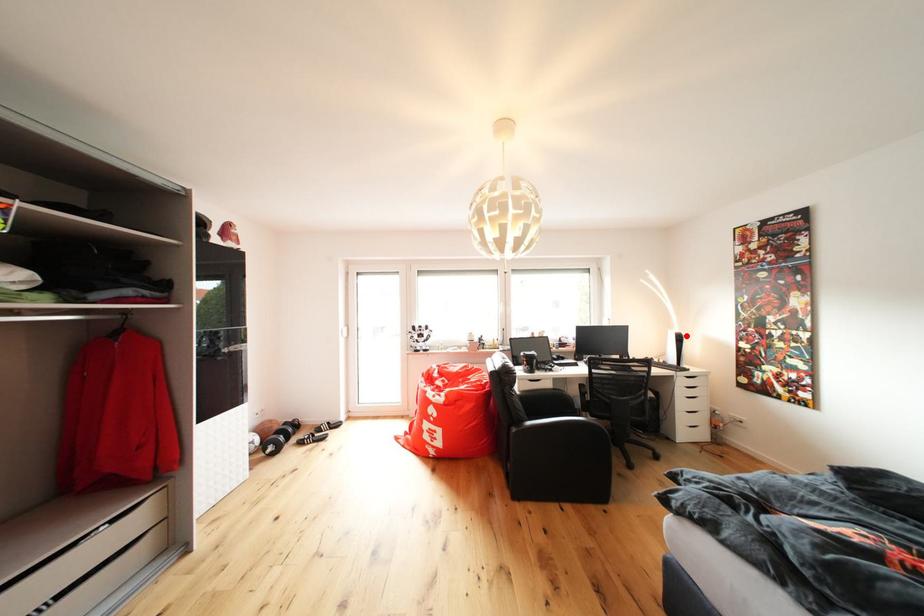
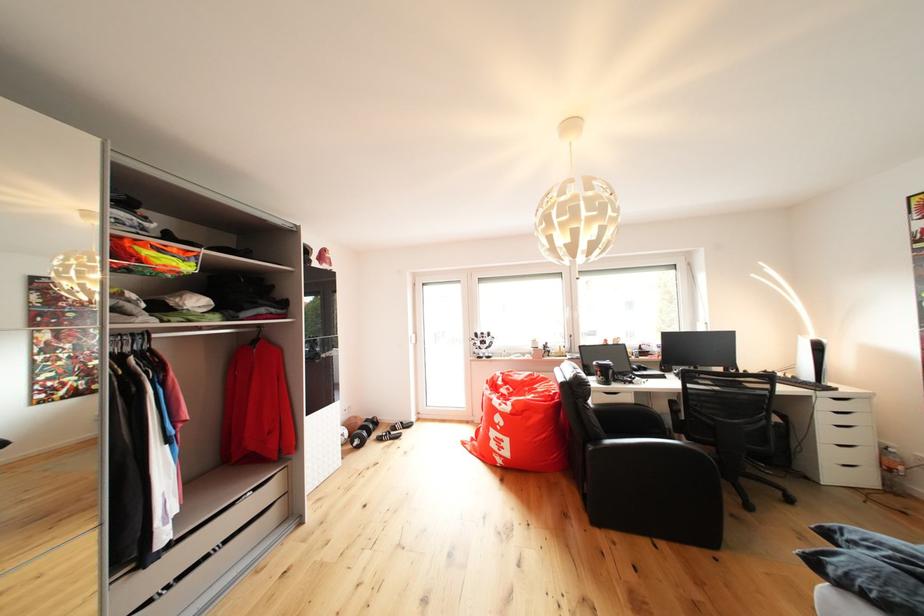
Question: I am providing you with two images of the same scene from different viewpoints. Given a red point in image1, look at the same physical point in image2. Is it:

Choices:
 (A) Closer to the viewpoint
 (B) Farther from the viewpoint

Answer: (A)